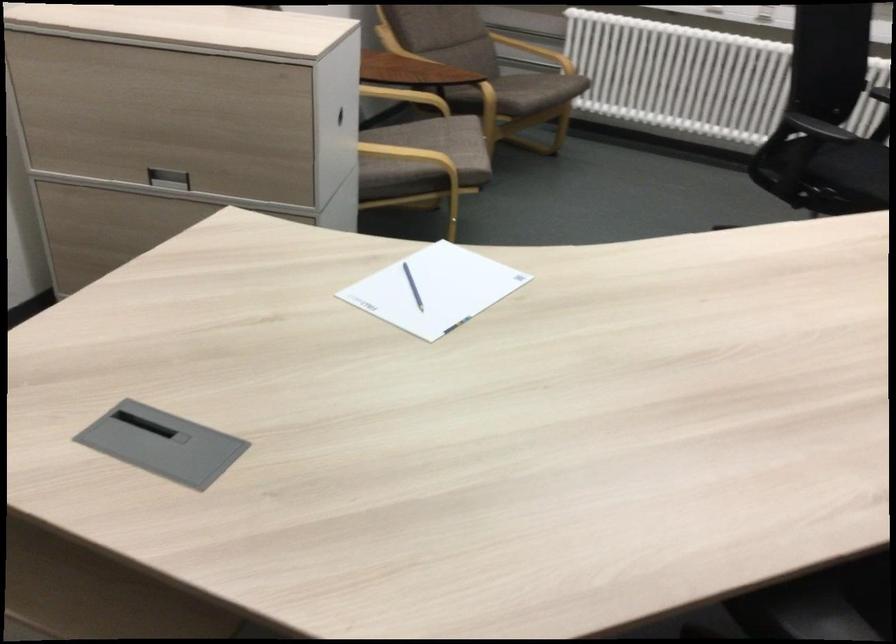
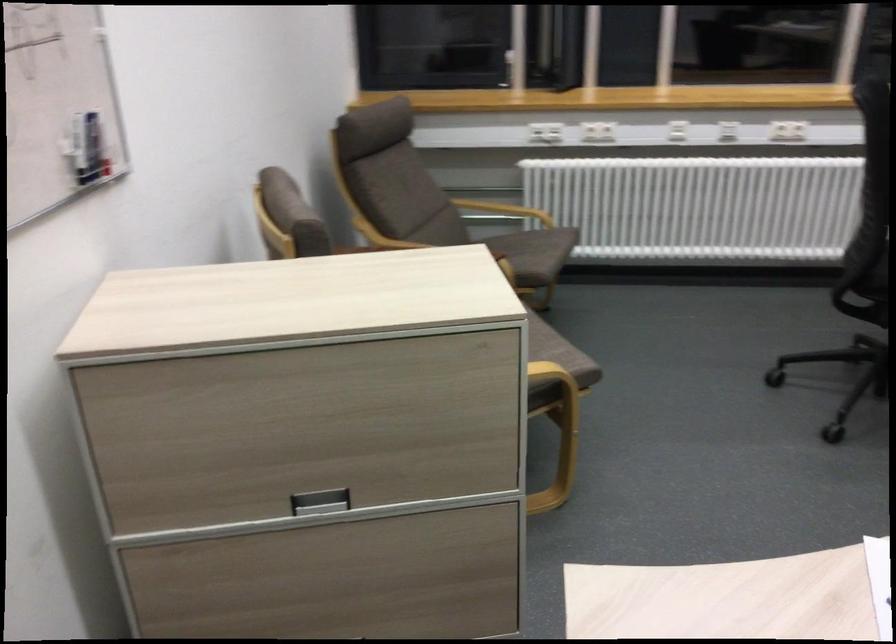
Which direction would the cameraman need to move to produce the second image?

The movement direction of the cameraman is left, forward.